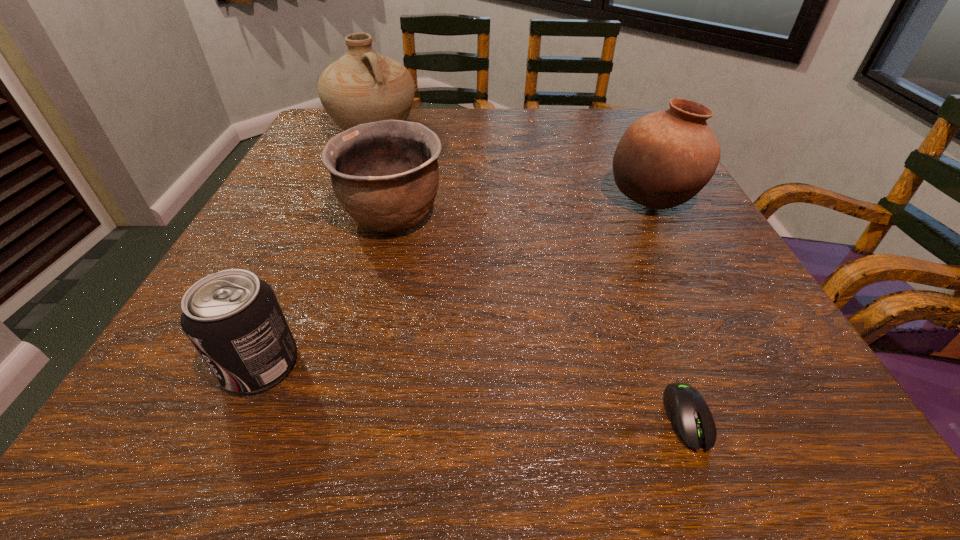
In order to click on vacant area between the rightmost pottery and the farthest pottery in this screenshot , I will do `click(513, 165)`.

Identify the location of free spot between the computer mouse and the rightmost pottery. The height and width of the screenshot is (540, 960). (670, 309).

Find the location of a particular element. The image size is (960, 540). vacant space that's between the computer mouse and the shortest pottery is located at coordinates (540, 318).

This screenshot has height=540, width=960. What are the coordinates of `unoccupied position between the rightmost pottery and the shortest object` in the screenshot? It's located at 670,309.

This screenshot has width=960, height=540. I want to click on empty location between the shortest object and the soda can, so click(x=474, y=391).

Find the location of a particular element. unoccupied area between the computer mouse and the rightmost pottery is located at coordinates (670, 309).

You are a GUI agent. You are given a task and a screenshot of the screen. Output one action in this format:
    pyautogui.click(x=<x>, y=<y>)
    Task: Click on the object that can be found as the fourth closest to the shortest pottery
    The height and width of the screenshot is (540, 960).
    Given the screenshot: What is the action you would take?
    pyautogui.click(x=688, y=412)

Point out which object is positioned as the fourth nearest to the soda can. Please provide its 2D coordinates. Your answer should be formatted as a tuple, i.e. [(x, y)], where the tuple contains the x and y coordinates of a point satisfying the conditions above.

[(665, 158)]

Select which pottery appears as the second closest to the soda can. Please provide its 2D coordinates. Your answer should be formatted as a tuple, i.e. [(x, y)], where the tuple contains the x and y coordinates of a point satisfying the conditions above.

[(363, 86)]

At what (x,y) coordinates should I click in order to perform the action: click on pottery that stands as the second closest to the soda can. Please return your answer as a coordinate pair (x, y). The height and width of the screenshot is (540, 960). Looking at the image, I should click on (363, 86).